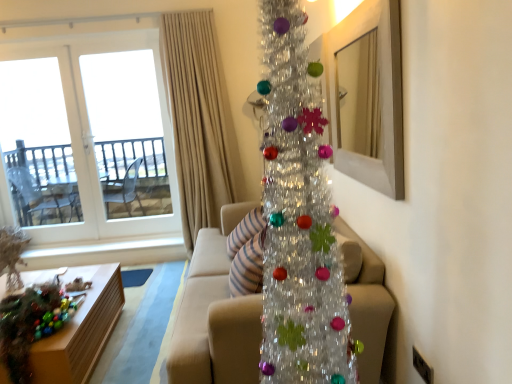
Question: Does point (331, 44) appear closer or farther from the camera than point (199, 23)?

Choices:
 (A) farther
 (B) closer

Answer: (B)

Question: In the image, is wooden mirror at upper right on the left side or the right side of beige fabric curtain at upper center?

Choices:
 (A) right
 (B) left

Answer: (A)

Question: Estimate the real-world distances between objects in this image. Which object is farther from the transparent glass door at upper left?

Choices:
 (A) beige fabric curtain at upper center
 (B) wooden mirror at upper right
 (C) shiny metallic christmas tree at center
 (D) wooden table at lower left
 (E) beige fabric couch at center

Answer: (C)

Question: Estimate the real-world distances between objects in this image. Which object is farther from the beige fabric couch at center?

Choices:
 (A) shiny metallic christmas tree at center
 (B) beige fabric curtain at upper center
 (C) wooden table at lower left
 (D) transparent glass door at upper left
 (E) wooden mirror at upper right

Answer: (D)